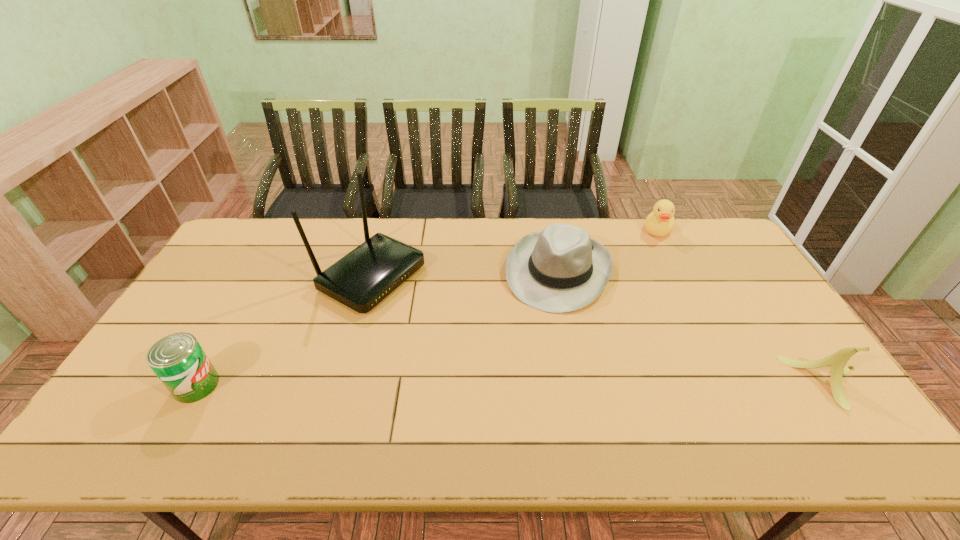
What are the coordinates of `vacant area situated 0.350m on the front-facing side of the fedora` in the screenshot? It's located at (506, 408).

Locate an element on the screen. Image resolution: width=960 pixels, height=540 pixels. free space located at the beak of the second object from right to left is located at coordinates (646, 268).

The image size is (960, 540). I want to click on free location located 0.080m at the beak of the second object from right to left, so click(x=652, y=253).

I want to click on vacant area situated at the beak of the second object from right to left, so click(x=649, y=259).

The image size is (960, 540). I want to click on vacant region located on the front-facing side of the router, so click(x=526, y=356).

Locate an element on the screen. This screenshot has width=960, height=540. free space located 0.380m on the front-facing side of the router is located at coordinates (519, 353).

Locate an element on the screen. This screenshot has width=960, height=540. vacant space located 0.350m on the front-facing side of the router is located at coordinates (510, 348).

Where is `fedora that is at the far edge`? The width and height of the screenshot is (960, 540). fedora that is at the far edge is located at coordinates (560, 269).

Where is `duck that is at the far edge`? duck that is at the far edge is located at coordinates (660, 222).

Image resolution: width=960 pixels, height=540 pixels. I want to click on router located at the far edge, so click(360, 280).